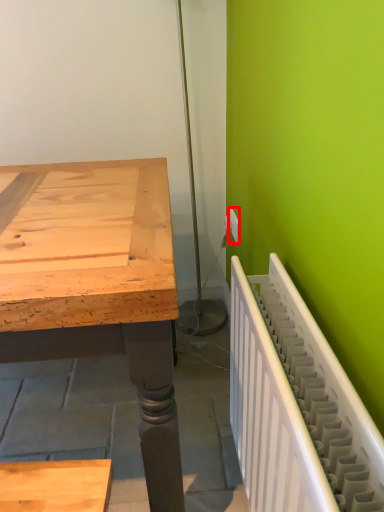
Question: In this image, where is electric outlet (annotated by the red box) located relative to radiator?

Choices:
 (A) right
 (B) left

Answer: (B)